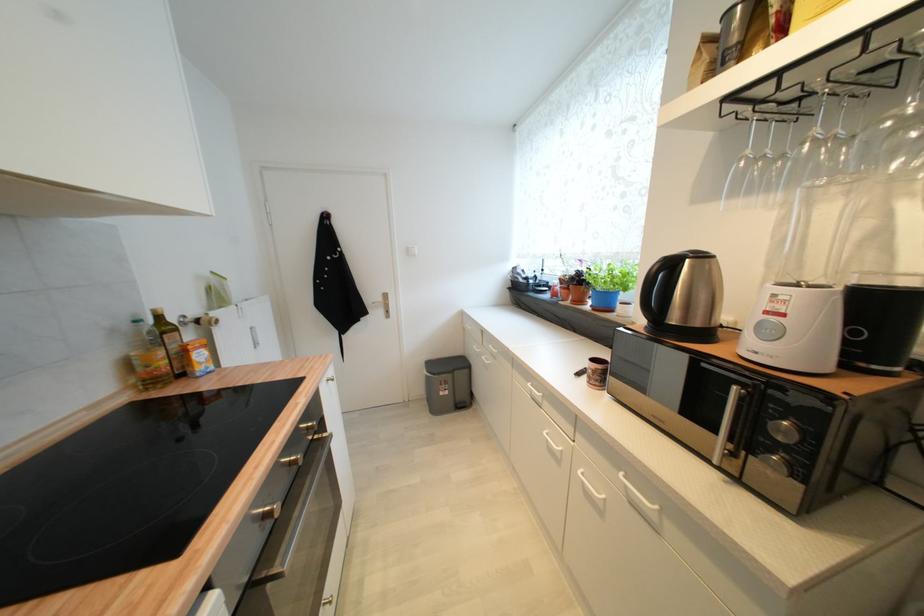
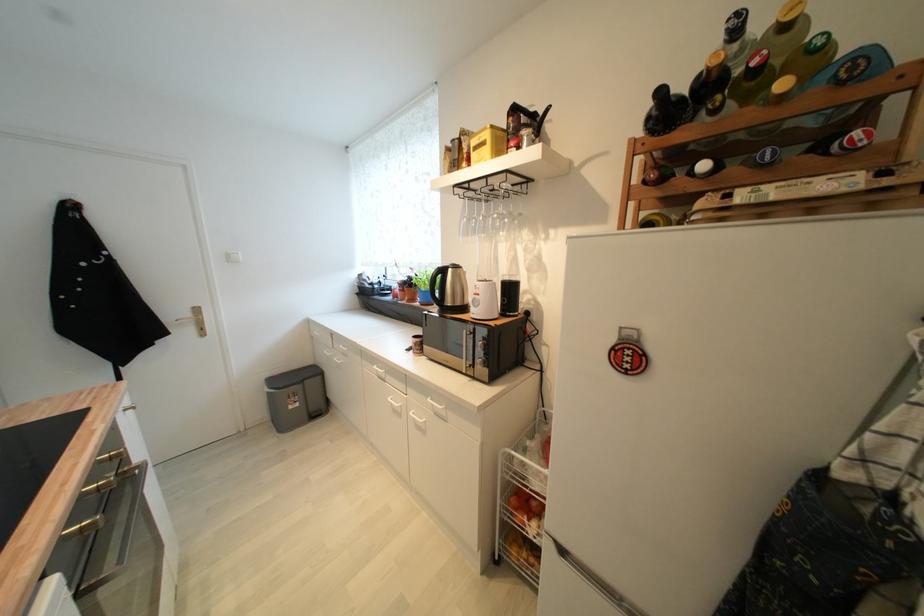
In the second image, find the point that corresponds to the point at 386,314 in the first image.

(197, 331)